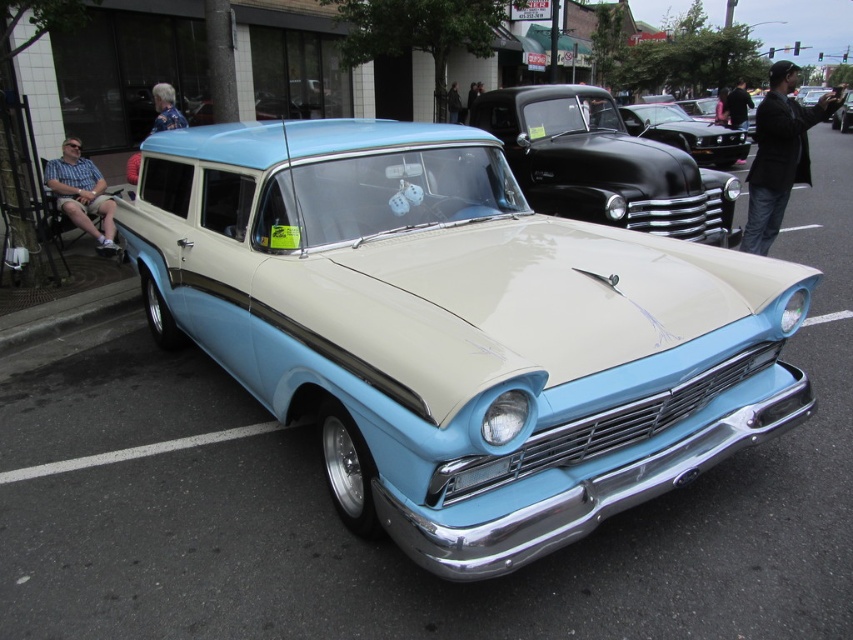
You are at a car show and see two cars parked side by side. The shiny black car at center and the light blue metallic car at center. Which one is positioned more to the left?

The shiny black car at center is positioned to the left of the light blue metallic car at center, so it is more to the left.

You are standing at the center of the street. Where is the glossy black car at center located relative to your position?

The glossy black car at center is located at point (604, 164) relative to your position.